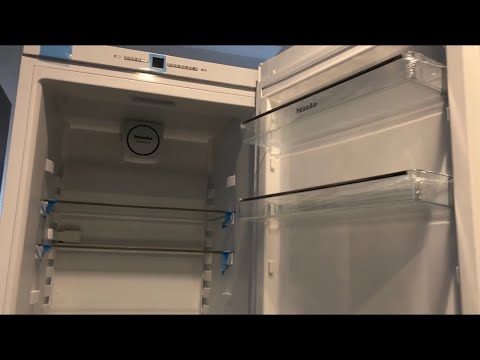
Where is `plastic shelves`? Image resolution: width=480 pixels, height=360 pixels. plastic shelves is located at coordinates (378, 97), (380, 204).